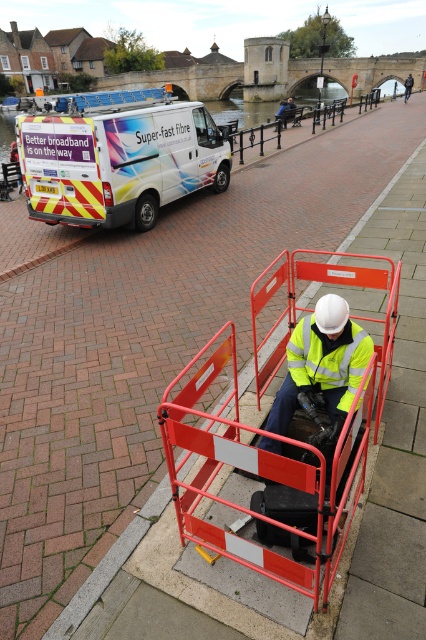
Does white glossy van at upper left appear under yellow high-visibility fabric safety vest at center?

No.

Who is positioned more to the right, white glossy van at upper left or yellow high-visibility fabric safety vest at center?

yellow high-visibility fabric safety vest at center

Identify the location of white glossy van at upper left. Image resolution: width=426 pixels, height=640 pixels. (118, 156).

Identify the location of white glossy van at upper left. Image resolution: width=426 pixels, height=640 pixels. (118, 156).